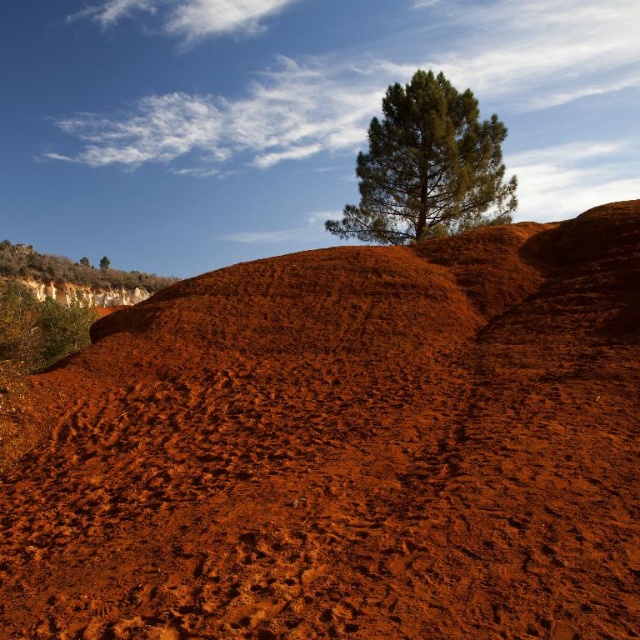
Question: Is dusty red soil at center in front of green textured tree at upper left?

Choices:
 (A) no
 (B) yes

Answer: (B)

Question: Which of these objects is positioned farthest from the green textured tree at upper center?

Choices:
 (A) dusty red soil at center
 (B) green leafy tree at upper left

Answer: (B)

Question: Is green textured tree at upper center behind green leafy tree at upper left?

Choices:
 (A) no
 (B) yes

Answer: (A)

Question: Considering the real-world distances, which object is closest to the green textured tree at upper left?

Choices:
 (A) dusty red soil at center
 (B) green textured tree at upper center

Answer: (B)

Question: Which point is closer to the camera?

Choices:
 (A) (280, 588)
 (B) (468, 212)
 (C) (99, 260)
 (D) (60, 276)

Answer: (A)

Question: From the image, what is the correct spatial relationship of dusty red soil at center in relation to green textured tree at upper left?

Choices:
 (A) above
 (B) below

Answer: (B)